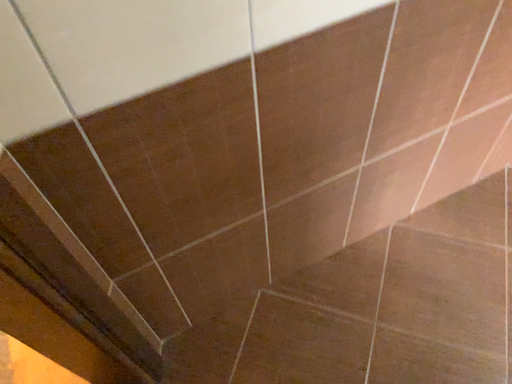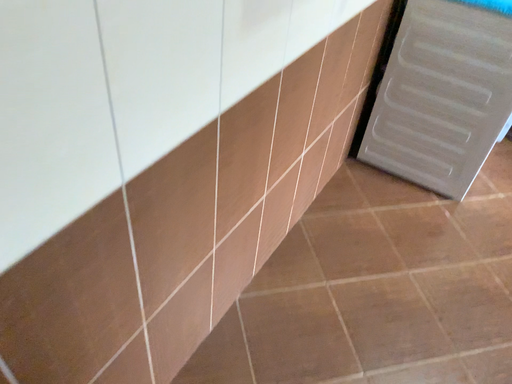
Question: Which way did the camera rotate in the video?

Choices:
 (A) rotated upward
 (B) rotated downward

Answer: (A)